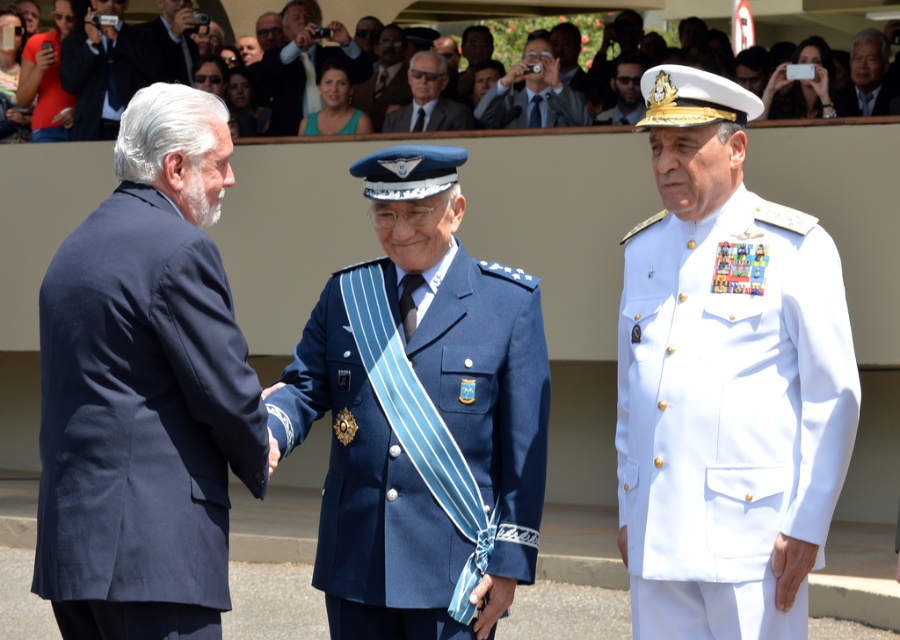
Question: Among these objects, which one is nearest to the camera?

Choices:
 (A) blue fabric uniform at upper center
 (B) white cotton uniform at center
 (C) matte black suit at upper left

Answer: (B)

Question: In this image, where is red cotton t-shirt at upper left located relative to matte black suit at upper center?

Choices:
 (A) below
 (B) above

Answer: (B)

Question: Among these points, which one is farthest from the camera?

Choices:
 (A) (60, 252)
 (B) (721, 346)
 (C) (847, 93)
 (D) (545, 387)

Answer: (C)

Question: Which of the following is the closest to the observer?

Choices:
 (A) (883, 112)
 (B) (576, 97)

Answer: (A)

Question: Can you confirm if matte black suit at upper left is smaller than blue fabric shirt at center?

Choices:
 (A) yes
 (B) no

Answer: (A)

Question: Is blue fabric uniform at center closer to camera compared to gray hair at upper right?

Choices:
 (A) no
 (B) yes

Answer: (B)